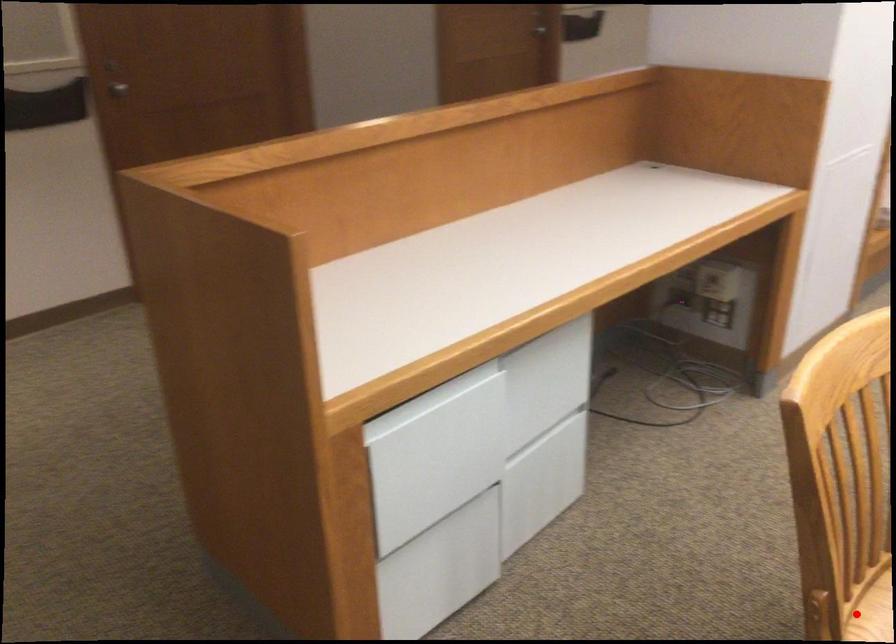
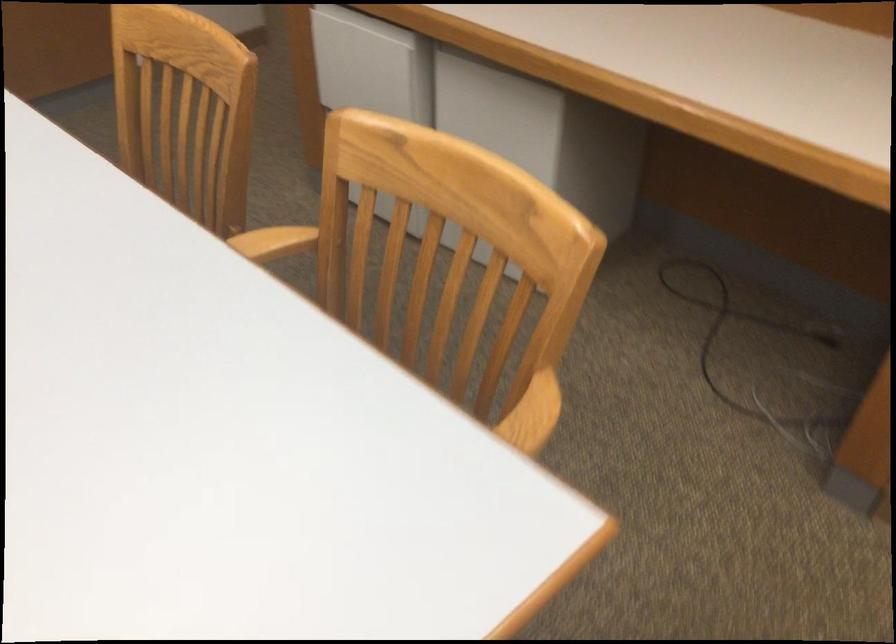
Question: I am providing you with two images of the same scene from different viewpoints. A red point is marked on the first image. Can you still see the location of the red point in image 2?

Choices:
 (A) Yes
 (B) No

Answer: (B)